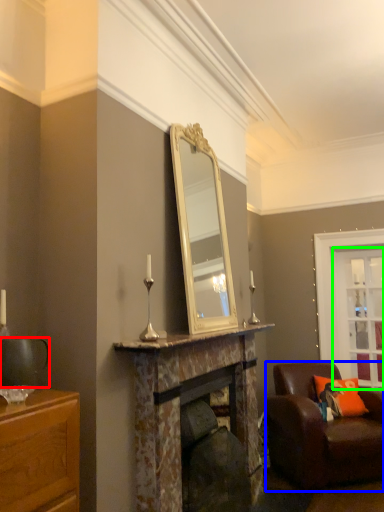
Question: Which is farther away from coffee cup (highlighted by a red box)? chair (highlighted by a blue box) or glass door (highlighted by a green box)?

Choices:
 (A) chair
 (B) glass door

Answer: (B)